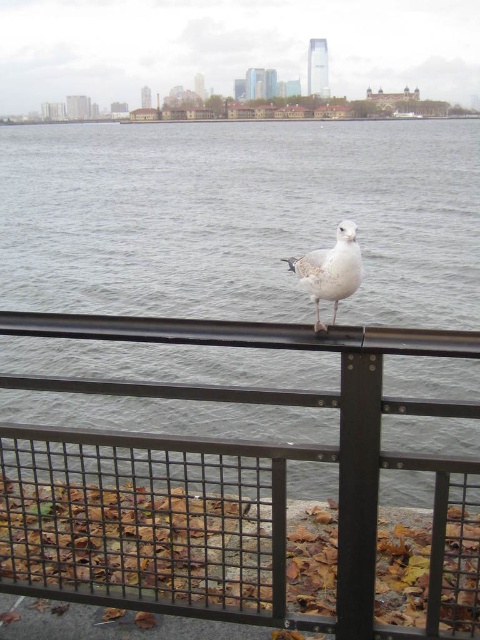
Question: Which of the following is the farthest from the observer?

Choices:
 (A) white feathered bird at center
 (B) gray water at center
 (C) black metal fence at center

Answer: (B)

Question: Does gray water at center come behind black metal fence at center?

Choices:
 (A) no
 (B) yes

Answer: (B)

Question: Can you confirm if gray water at center is bigger than white feathered bird at center?

Choices:
 (A) no
 (B) yes

Answer: (B)

Question: Which of the following is the farthest from the observer?

Choices:
 (A) (357, 285)
 (B) (26, 468)
 (C) (446, 266)

Answer: (C)

Question: Which point is closer to the camera?

Choices:
 (A) (x=312, y=288)
 (B) (x=279, y=154)

Answer: (A)

Question: Is black metal fence at center wider than white feathered bird at center?

Choices:
 (A) yes
 (B) no

Answer: (A)